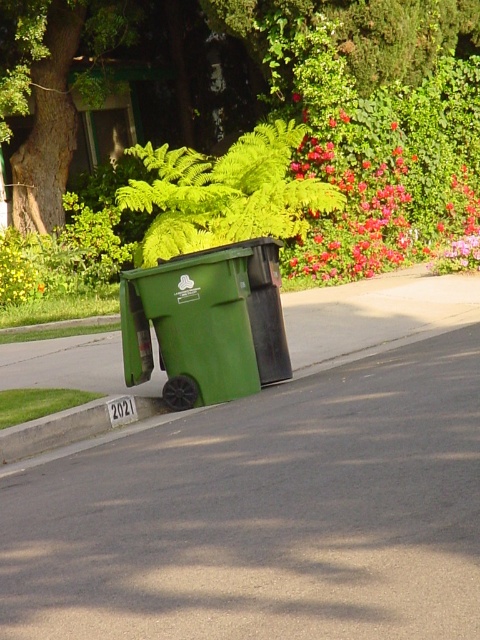
You are standing on the suburban street scene described. You want to place a small potted plant exactly at the point marked by the coordinates point (226, 193). What object will the potted plant be placed near?

The point (226, 193) indicates the green leafy fern at center, so placing the potted plant there would position it near the green leafy fern at center.

You are a gardener who needs to water both the green leafy fern at center and the yellow matte flower at upper left. Based on their positions, which one do you think is closer to the water source located at the bottom of the image?

The yellow matte flower at upper left is closer to the water source at the bottom of the image because the green leafy fern at center is located above it, meaning the fern is higher up and the flower is lower down.

You are standing at the curb in front of the green recycling bin with a black lid and wheels. You see two points marked in the scene. Which point is closer to you, point (x=93, y=22) or point (x=16, y=269)?

Point (x=93, y=22) is further to the camera than point (x=16, y=269), so the point closer to you is point (x=16, y=269).